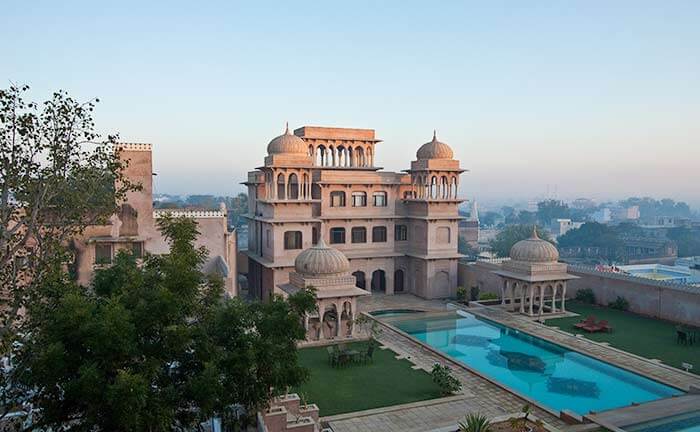
Locate an element on the screen. The width and height of the screenshot is (700, 432). chairs is located at coordinates (350, 353), (690, 335).